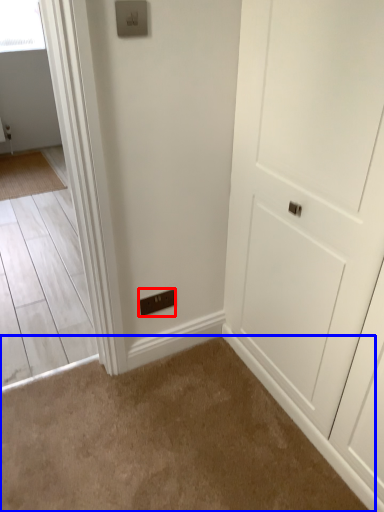
Question: Which point is further to the camera, light switch (highlighted by a red box) or plain (highlighted by a blue box)?

Choices:
 (A) light switch
 (B) plain

Answer: (A)